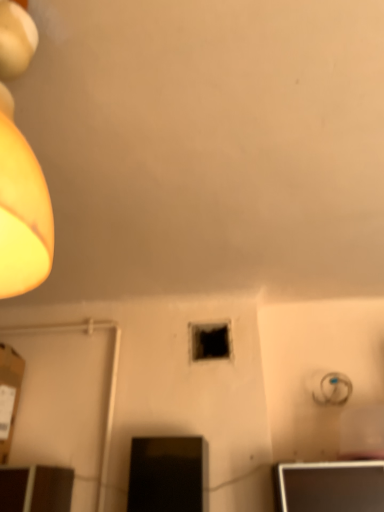
You are a GUI agent. You are given a task and a screenshot of the screen. Output one action in this format:
    pyautogui.click(x=<x>, y=<y>)
    Task: Click on the black matte hole at center
    This screenshot has width=384, height=512.
    Given the screenshot: What is the action you would take?
    pyautogui.click(x=210, y=341)

Describe the element at coordinates (210, 341) in the screenshot. I see `black matte hole at center` at that location.

Find the location of a particular element. black matte hole at center is located at coordinates (210, 341).